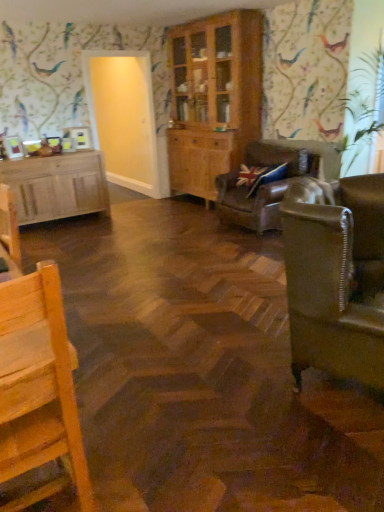
Find the location of a particular element. wooden cabinet at center, which is the 2th cabinetry from left to right is located at coordinates coord(213,98).

Where is `leather sofa at center, which is counted as the second studio couch, starting from the front`? The width and height of the screenshot is (384, 512). leather sofa at center, which is counted as the second studio couch, starting from the front is located at coordinates (263, 185).

The width and height of the screenshot is (384, 512). What do you see at coordinates (336, 277) in the screenshot? I see `leather couch at right, which is the 1th studio couch from front to back` at bounding box center [336, 277].

What is the approximate height of leather couch at right, positioned as the second studio couch in back-to-front order?

The height of leather couch at right, positioned as the second studio couch in back-to-front order, is 3.46 feet.

Measure the distance between point (49, 389) and camera.

Point (49, 389) and camera are 1.32 meters apart.

Describe the element at coordinates (57, 186) in the screenshot. I see `light wood cabinet at left, marked as the 2th cabinetry in a right-to-left arrangement` at that location.

The image size is (384, 512). Identify the location of transparent glass door at upper left. (123, 117).

Can you confirm if light wood cabinet at left, arranged as the first cabinetry when viewed from the left, is shorter than wooden chair at lower left?

Yes.

Visually, is light wood cabinet at left, arranged as the first cabinetry when viewed from the left, positioned to the left or to the right of wooden chair at lower left?

Based on their positions, light wood cabinet at left, arranged as the first cabinetry when viewed from the left, is located to the left of wooden chair at lower left.

Who is bigger, light wood cabinet at left, marked as the 2th cabinetry in a right-to-left arrangement, or wooden chair at lower left?

With larger size is light wood cabinet at left, marked as the 2th cabinetry in a right-to-left arrangement.

Is light wood cabinet at left, marked as the 2th cabinetry in a right-to-left arrangement, turned away from wooden chair at lower left?

light wood cabinet at left, marked as the 2th cabinetry in a right-to-left arrangement, is not turned away from wooden chair at lower left.

From a real-world perspective, is leather couch at right, which is the 1th studio couch from front to back, located beneath leather sofa at center, the first studio couch viewed from the back?

Actually, leather couch at right, which is the 1th studio couch from front to back, is physically above leather sofa at center, the first studio couch viewed from the back, in the real world.

From the picture: Does leather couch at right, which is the 1th studio couch from front to back, have a lesser width compared to leather sofa at center, which is counted as the second studio couch, starting from the front?

Indeed, leather couch at right, which is the 1th studio couch from front to back, has a lesser width compared to leather sofa at center, which is counted as the second studio couch, starting from the front.

Is leather couch at right, positioned as the second studio couch in back-to-front order, to the left of leather sofa at center, the first studio couch viewed from the back, from the viewer's perspective?

Yes, leather couch at right, positioned as the second studio couch in back-to-front order, is to the left of leather sofa at center, the first studio couch viewed from the back.

Looking at this image, is leather couch at right, which is the 1th studio couch from front to back, bigger than leather sofa at center, the first studio couch viewed from the back?

No.

Can you see light wood cabinet at left, arranged as the first cabinetry when viewed from the left, touching leather couch at right, which is the 1th studio couch from front to back?

No, light wood cabinet at left, arranged as the first cabinetry when viewed from the left, is not in contact with leather couch at right, which is the 1th studio couch from front to back.

Which is closer, (37,184) or (299,350)?

Point (37,184) is positioned farther from the camera compared to point (299,350).

Is leather couch at right, positioned as the second studio couch in back-to-front order, a part of light wood cabinet at left, arranged as the first cabinetry when viewed from the left?

No, leather couch at right, positioned as the second studio couch in back-to-front order, is not a part of light wood cabinet at left, arranged as the first cabinetry when viewed from the left.

Considering the relative sizes of light wood cabinet at left, marked as the 2th cabinetry in a right-to-left arrangement, and leather couch at right, which is the 1th studio couch from front to back, in the image provided, is light wood cabinet at left, marked as the 2th cabinetry in a right-to-left arrangement, thinner than leather couch at right, which is the 1th studio couch from front to back,?

Yes, light wood cabinet at left, marked as the 2th cabinetry in a right-to-left arrangement, is thinner than leather couch at right, which is the 1th studio couch from front to back.

Considering the points (288, 265) and (69, 387), which point is behind, point (288, 265) or point (69, 387)?

Point (288, 265)

Could you measure the distance between leather couch at right, which is the 1th studio couch from front to back, and wooden chair at lower left?

leather couch at right, which is the 1th studio couch from front to back, and wooden chair at lower left are 1.28 meters apart.

Which object is thinner, leather couch at right, which is the 1th studio couch from front to back, or wooden chair at lower left?

With smaller width is wooden chair at lower left.

From the image's perspective, who appears lower, leather couch at right, positioned as the second studio couch in back-to-front order, or wooden chair at lower left?

wooden chair at lower left, from the image's perspective.

Can you confirm if wooden chair at lower left is positioned to the left of wooden cabinet at center, arranged as the 1th cabinetry when viewed from the right?

Yes.

Between wooden chair at lower left and wooden cabinet at center, arranged as the 1th cabinetry when viewed from the right, which one has smaller size?

Smaller between the two is wooden chair at lower left.

Can you tell me how much wooden chair at lower left and wooden cabinet at center, arranged as the 1th cabinetry when viewed from the right, differ in facing direction?

89.2 degrees.

From the image's perspective, count 2nd cabinetrys upward from the leather sofa at center, the first studio couch viewed from the back, and point to it. Please provide its 2D coordinates.

[(213, 98)]

Looking at this image, between wooden cabinet at center, arranged as the 1th cabinetry when viewed from the right, and leather sofa at center, the first studio couch viewed from the back, which one has smaller width?

Answer: wooden cabinet at center, arranged as the 1th cabinetry when viewed from the right, is thinner.

Consider the image. Would you consider wooden cabinet at center, arranged as the 1th cabinetry when viewed from the right, to be distant from leather sofa at center, which is counted as the second studio couch, starting from the front?

wooden cabinet at center, arranged as the 1th cabinetry when viewed from the right, is actually quite close to leather sofa at center, which is counted as the second studio couch, starting from the front.

From a real-world perspective, is wooden cabinet at center, which is the 2th cabinetry from left to right, beneath leather sofa at center, which is counted as the second studio couch, starting from the front?

No, from a real-world perspective, wooden cabinet at center, which is the 2th cabinetry from left to right, is not below leather sofa at center, which is counted as the second studio couch, starting from the front.

Is point (1, 397) positioned behind point (157, 170)?

No.

Is transparent glass door at upper left at the back of wooden chair at lower left?

wooden chair at lower left does not have its back to transparent glass door at upper left.

Who is shorter, wooden chair at lower left or transparent glass door at upper left?

wooden chair at lower left.

From the image's perspective, is wooden chair at lower left on top of transparent glass door at upper left?

No.

There is a light wood cabinet at left, arranged as the first cabinetry when viewed from the left. Where is `chair above it (from a real-world perspective)`? chair above it (from a real-world perspective) is located at coordinates (38, 383).

Find the location of a particular element. studio couch located above the leather couch at right, positioned as the second studio couch in back-to-front order (from the image's perspective) is located at coordinates (263, 185).

Estimate the real-world distances between objects in this image. Which object is further from transparent glass door at upper left, leather sofa at center, which is counted as the second studio couch, starting from the front, or wooden chair at lower left?

The object further to transparent glass door at upper left is wooden chair at lower left.

Considering their positions, is leather couch at right, positioned as the second studio couch in back-to-front order, positioned further to light wood cabinet at left, arranged as the first cabinetry when viewed from the left, than leather sofa at center, which is counted as the second studio couch, starting from the front?

The object further to light wood cabinet at left, arranged as the first cabinetry when viewed from the left, is leather couch at right, positioned as the second studio couch in back-to-front order.

When comparing their distances from wooden cabinet at center, which is the 2th cabinetry from left to right, does leather sofa at center, the first studio couch viewed from the back, or transparent glass door at upper left seem closer?

Based on the image, transparent glass door at upper left appears to be nearer to wooden cabinet at center, which is the 2th cabinetry from left to right.

Estimate the real-world distances between objects in this image. Which object is closer to light wood cabinet at left, arranged as the first cabinetry when viewed from the left, leather sofa at center, the first studio couch viewed from the back, or leather couch at right, which is the 1th studio couch from front to back?

The object closer to light wood cabinet at left, arranged as the first cabinetry when viewed from the left, is leather sofa at center, the first studio couch viewed from the back.

Estimate the real-world distances between objects in this image. Which object is further from leather sofa at center, which is counted as the second studio couch, starting from the front, wooden cabinet at center, arranged as the 1th cabinetry when viewed from the right, or leather couch at right, which is the 1th studio couch from front to back?

leather couch at right, which is the 1th studio couch from front to back, is further to leather sofa at center, which is counted as the second studio couch, starting from the front.

Estimate the real-world distances between objects in this image. Which object is further from wooden cabinet at center, which is the 2th cabinetry from left to right, leather sofa at center, which is counted as the second studio couch, starting from the front, or light wood cabinet at left, arranged as the first cabinetry when viewed from the left?

light wood cabinet at left, arranged as the first cabinetry when viewed from the left, lies further to wooden cabinet at center, which is the 2th cabinetry from left to right, than the other object.

Which object lies nearer to the anchor point wooden chair at lower left, leather couch at right, positioned as the second studio couch in back-to-front order, or light wood cabinet at left, arranged as the first cabinetry when viewed from the left?

Among the two, leather couch at right, positioned as the second studio couch in back-to-front order, is located nearer to wooden chair at lower left.

From the image, which object appears to be farther from wooden chair at lower left, wooden cabinet at center, arranged as the 1th cabinetry when viewed from the right, or transparent glass door at upper left?

transparent glass door at upper left is positioned further to the anchor wooden chair at lower left.

This screenshot has height=512, width=384. What are the coordinates of `cabinetry between leather couch at right, positioned as the second studio couch in back-to-front order, and light wood cabinet at left, arranged as the first cabinetry when viewed from the left, along the z-axis` in the screenshot? It's located at (213, 98).

Locate an element on the screen. The height and width of the screenshot is (512, 384). studio couch positioned between wooden chair at lower left and leather sofa at center, which is counted as the second studio couch, starting from the front, from near to far is located at coordinates (336, 277).

You are a GUI agent. You are given a task and a screenshot of the screen. Output one action in this format:
    pyautogui.click(x=<x>, y=<y>)
    Task: Click on the studio couch between leather couch at right, which is the 1th studio couch from front to back, and transparent glass door at upper left, along the z-axis
    
    Given the screenshot: What is the action you would take?
    pyautogui.click(x=263, y=185)

Where is `glass door between light wood cabinet at left, arranged as the first cabinetry when viewed from the left, and wooden cabinet at center, which is the 2th cabinetry from left to right`? The width and height of the screenshot is (384, 512). glass door between light wood cabinet at left, arranged as the first cabinetry when viewed from the left, and wooden cabinet at center, which is the 2th cabinetry from left to right is located at coordinates (123, 117).